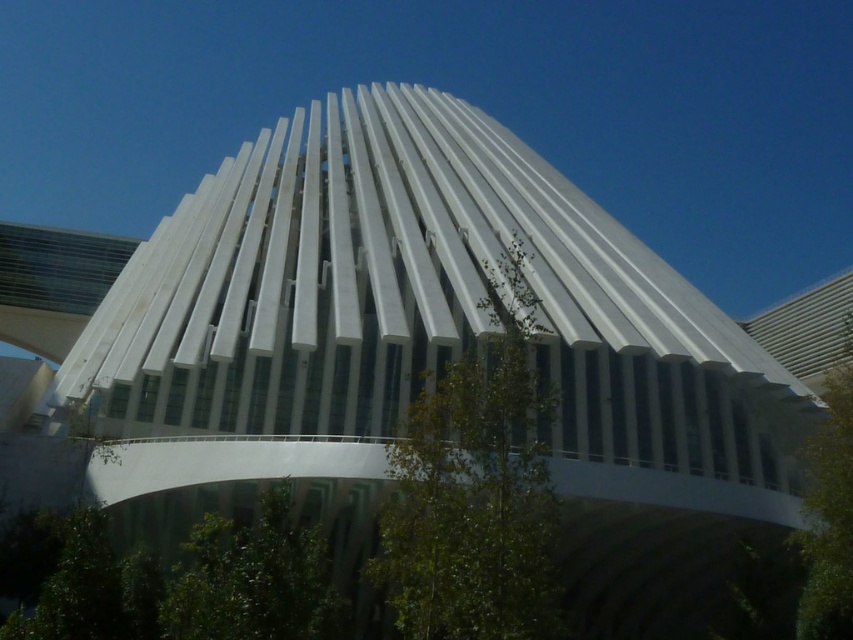
From the picture: You are standing at the center of the image and want to locate the green leafy tree at lower left. In which direction should you look to find it?

The green leafy tree at lower left is located at point (252, 579), so you should look to the lower left direction to find it.

You are standing at the camera position and want to take a photo of the green leafy tree at center. If your camera has a maximum focus range of 80 feet, will you be able to focus on the tree?

The green leafy tree at center is 88.05 feet away from camera. Since the camera can only focus up to 80 feet, it cannot focus on the tree.

From the picture: You are planning to plant a new tree in the garden adjacent to the architectural structure. The garden has limited space. Based on the image, which tree between the green leafy tree at lower left and the green leafy tree at right would require less horizontal space to accommodate?

The green leafy tree at lower left requires less horizontal space because its width is less than that of the green leafy tree at right.